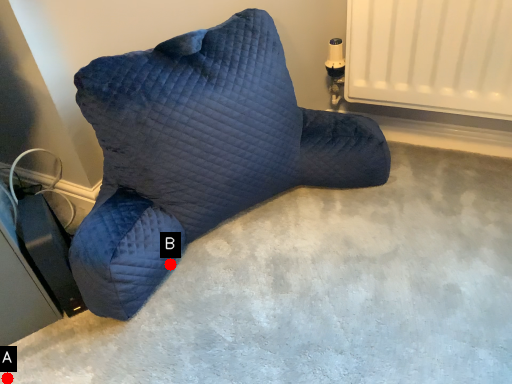
Question: Two points are circled on the image, labeled by A and B beside each circle. Which point appears closest to the camera in this image?

Choices:
 (A) A is closer
 (B) B is closer

Answer: (A)